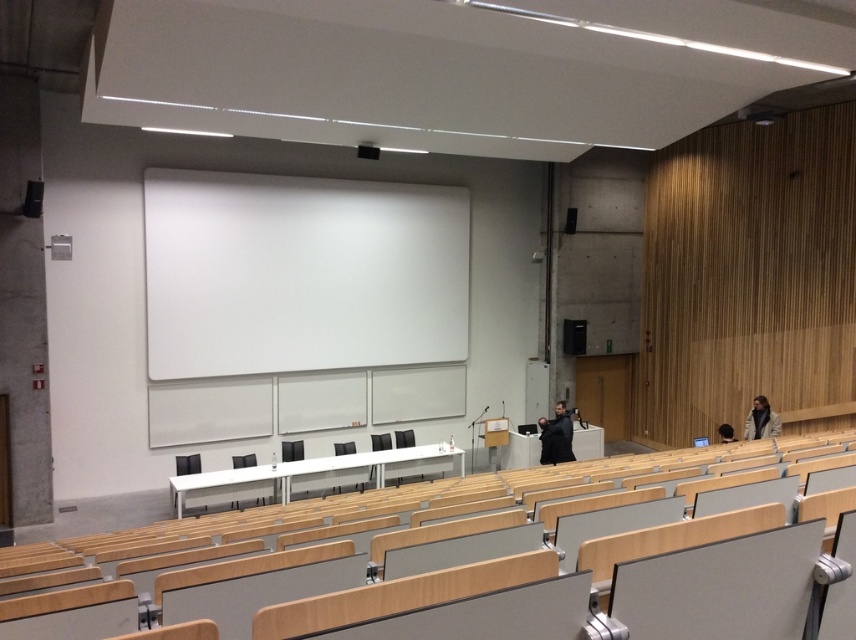
Question: Which point is farther to the camera?

Choices:
 (A) black matte speaker at upper right
 (B) black plastic speaker at right
 (C) white matte projection screen at center
 (D) black matte speaker at upper left

Answer: (B)

Question: Which of the following is the closest to the observer?

Choices:
 (A) (578, 330)
 (B) (438, 337)
 (C) (571, 205)

Answer: (B)

Question: Is the position of black plastic speaker at right more distant than that of black matte speaker at upper left?

Choices:
 (A) no
 (B) yes

Answer: (B)

Question: Is black plastic speaker at right above black matte speaker at upper left?

Choices:
 (A) yes
 (B) no

Answer: (B)

Question: Does white matte projection screen at center have a lesser width compared to black matte speaker at upper left?

Choices:
 (A) no
 (B) yes

Answer: (A)

Question: Which of these objects is positioned closest to the black plastic speaker at right?

Choices:
 (A) black matte speaker at upper left
 (B) white matte projection screen at center

Answer: (B)